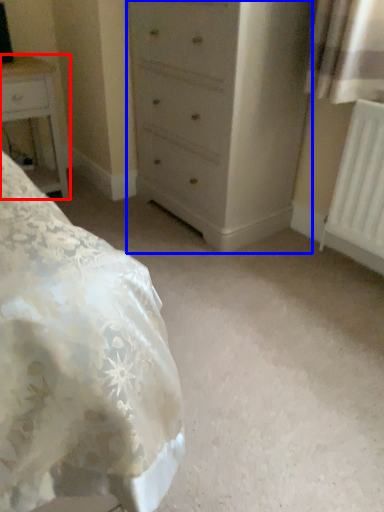
Question: Which object appears farthest to the camera in this image, nightstand (highlighted by a red box) or chest of drawers (highlighted by a blue box)?

Choices:
 (A) nightstand
 (B) chest of drawers

Answer: (A)